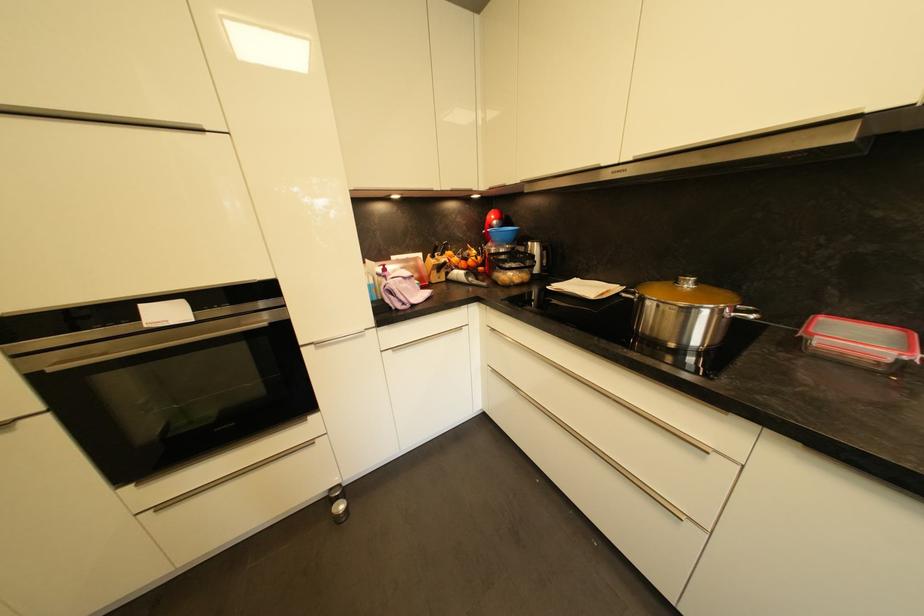
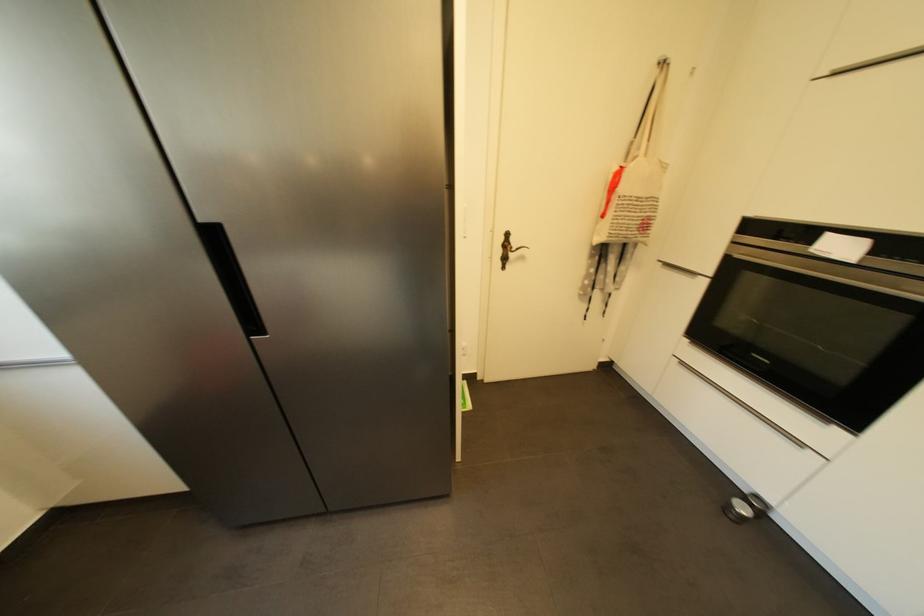
Based on the continuous images, in which direction is the camera rotating?

The camera rotated toward left-down.